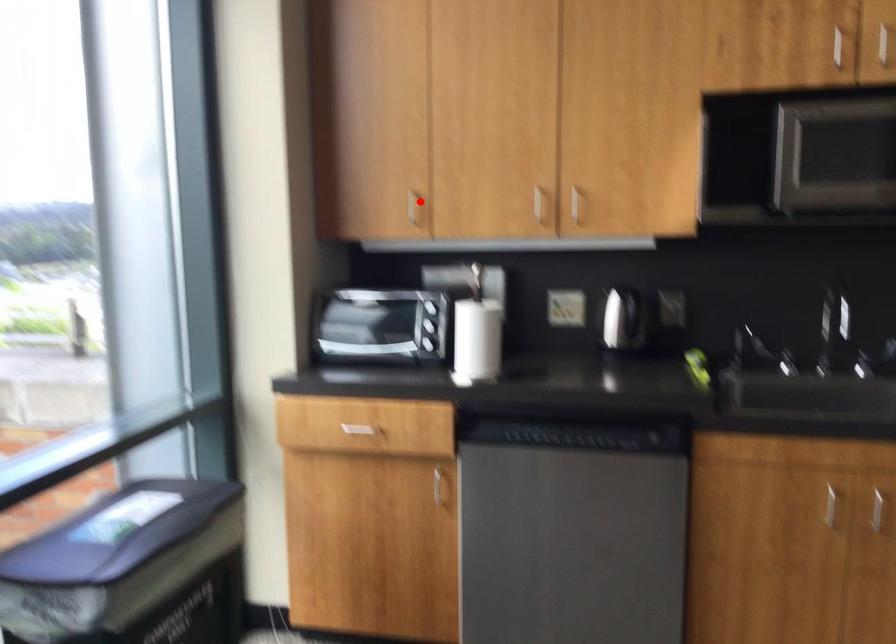
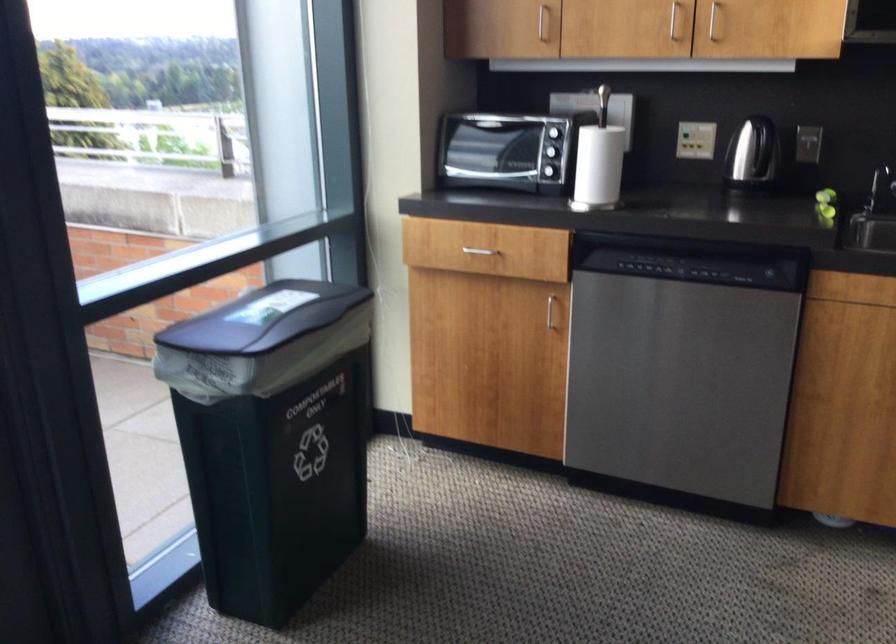
Locate, in the second image, the point that corresponds to the highlighted location in the first image.

(543, 23)